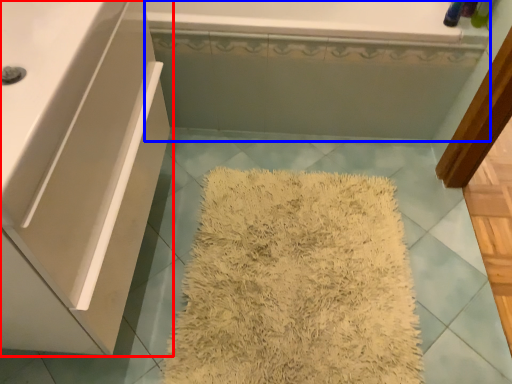
Question: Among these objects, which one is farthest to the camera, bathroom cabinet (highlighted by a red box) or bath (highlighted by a blue box)?

Choices:
 (A) bathroom cabinet
 (B) bath

Answer: (B)